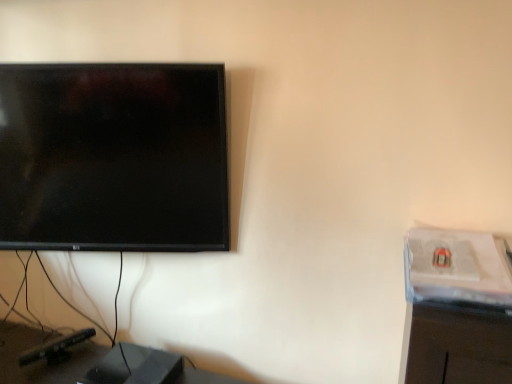
Locate an element on the screen. The height and width of the screenshot is (384, 512). black plastic speaker at lower left is located at coordinates (42, 359).

What do you see at coordinates (42, 359) in the screenshot? I see `black plastic speaker at lower left` at bounding box center [42, 359].

Image resolution: width=512 pixels, height=384 pixels. In order to click on clear plastic computer desk at right in this screenshot , I will do `click(458, 307)`.

What do you see at coordinates (458, 307) in the screenshot? I see `clear plastic computer desk at right` at bounding box center [458, 307].

Find the location of a particular element. Image resolution: width=512 pixels, height=384 pixels. black plastic speaker at lower left is located at coordinates (42, 359).

Does clear plastic computer desk at right appear on the right side of black plastic speaker at lower left?

Correct, you'll find clear plastic computer desk at right to the right of black plastic speaker at lower left.

In the image, is clear plastic computer desk at right positioned in front of or behind black plastic speaker at lower left?

clear plastic computer desk at right is positioned closer to the viewer than black plastic speaker at lower left.

Is point (444, 230) positioned after point (74, 381)?

No, it is in front of (74, 381).

From the image's perspective, does clear plastic computer desk at right appear higher than black plastic speaker at lower left?

Correct, clear plastic computer desk at right appears higher than black plastic speaker at lower left in the image.

From a real-world perspective, which is physically below, clear plastic computer desk at right or black plastic speaker at lower left?

black plastic speaker at lower left is physically lower.

Which object is wider, clear plastic computer desk at right or black plastic speaker at lower left?

black plastic speaker at lower left is wider.

Is clear plastic computer desk at right shorter than black plastic speaker at lower left?

Yes, clear plastic computer desk at right is shorter than black plastic speaker at lower left.

Is clear plastic computer desk at right smaller than black plastic speaker at lower left?

Yes, clear plastic computer desk at right is smaller than black plastic speaker at lower left.

Can we say clear plastic computer desk at right lies outside black plastic speaker at lower left?

Yes, clear plastic computer desk at right is located beyond the bounds of black plastic speaker at lower left.

Is clear plastic computer desk at right not close to black plastic speaker at lower left?

Indeed, clear plastic computer desk at right is not near black plastic speaker at lower left.

Is clear plastic computer desk at right looking in the opposite direction of black plastic speaker at lower left?

No.

How different are the orientations of clear plastic computer desk at right and black plastic speaker at lower left in degrees?

The angle between the facing direction of clear plastic computer desk at right and the facing direction of black plastic speaker at lower left is 1.21 degrees.

In order to click on computer desk that appears on the right of black plastic speaker at lower left in this screenshot , I will do 458,307.

Is black plastic speaker at lower left to the right of clear plastic computer desk at right from the viewer's perspective?

No.

Is the position of black plastic speaker at lower left less distant than that of clear plastic computer desk at right?

No, black plastic speaker at lower left is further to the viewer.

Based on the photo, which is farther from the camera, (93, 362) or (481, 262)?

The point (93, 362) is farther.

From the image's perspective, is black plastic speaker at lower left located above or below clear plastic computer desk at right?

black plastic speaker at lower left is below clear plastic computer desk at right.

From a real-world perspective, between black plastic speaker at lower left and clear plastic computer desk at right, who is vertically higher?

In real-world perspective, clear plastic computer desk at right is above.

Is black plastic speaker at lower left wider or thinner than clear plastic computer desk at right?

Clearly, black plastic speaker at lower left has more width compared to clear plastic computer desk at right.

Who is shorter, black plastic speaker at lower left or clear plastic computer desk at right?

clear plastic computer desk at right is shorter.

Between black plastic speaker at lower left and clear plastic computer desk at right, which one has smaller size?

With smaller size is clear plastic computer desk at right.

Does black plastic speaker at lower left contain clear plastic computer desk at right?

No, clear plastic computer desk at right is not a part of black plastic speaker at lower left.

Is black plastic speaker at lower left far from clear plastic computer desk at right?

black plastic speaker at lower left is positioned a significant distance from clear plastic computer desk at right.

Is clear plastic computer desk at right at the back of black plastic speaker at lower left?

black plastic speaker at lower left does not have its back to clear plastic computer desk at right.

What are the coordinates of `computer desk located above the black plastic speaker at lower left (from the image's perspective)` in the screenshot? It's located at (458, 307).

Find the location of a particular element. furniture located behind the clear plastic computer desk at right is located at coordinates (42, 359).

Where is `computer desk above the black plastic speaker at lower left (from the image's perspective)`? This screenshot has height=384, width=512. computer desk above the black plastic speaker at lower left (from the image's perspective) is located at coordinates (458, 307).